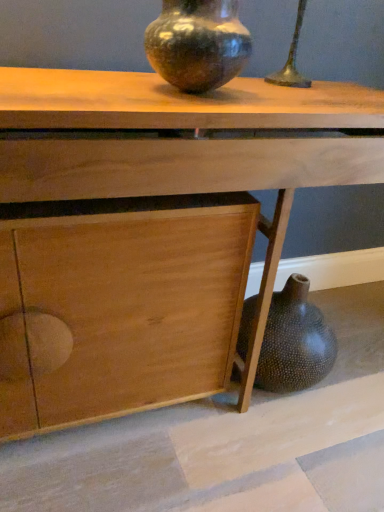
Image resolution: width=384 pixels, height=512 pixels. I want to click on free space in front of speckled dark brown vase at upper center, so click(x=177, y=105).